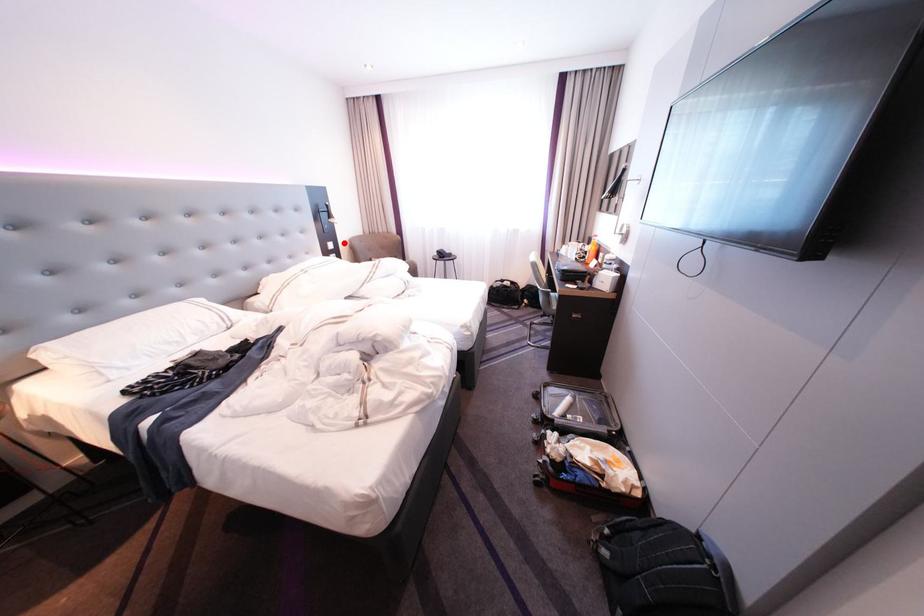
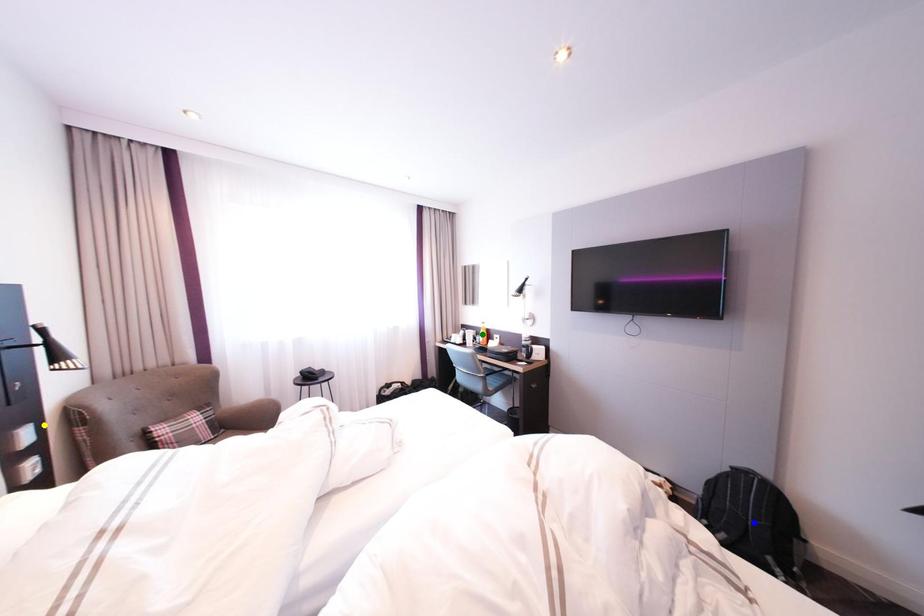
Question: I am providing you with two images of the same scene from different viewpoints. A red point is marked on the first image. You are given multiple points on the second image. Which point in image 2 is actually the same real-world point as the red point in image 1?

Choices:
 (A) yellow point
 (B) blue point
 (C) green point

Answer: (A)